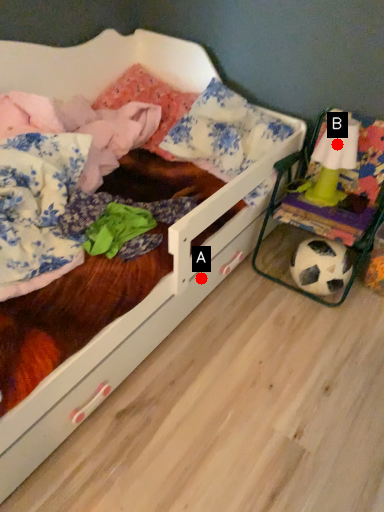
Question: Two points are circled on the image, labeled by A and B beside each circle. Among these points, which one is nearest to the camera?

Choices:
 (A) A is closer
 (B) B is closer

Answer: (B)